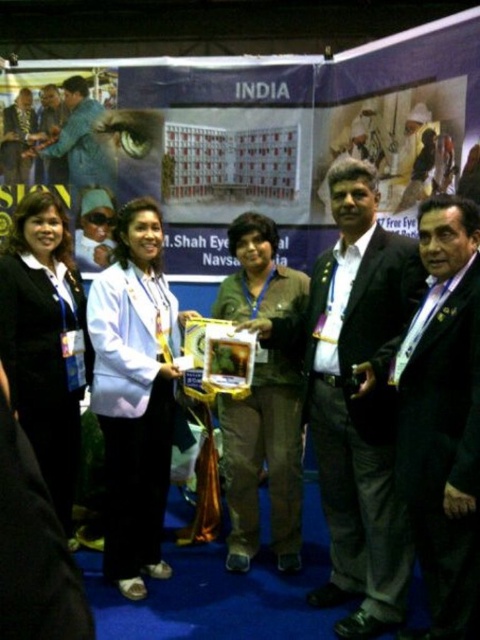
Question: Is the position of matte black sunglasses at upper left more distant than that of matte black suit at center?

Choices:
 (A) yes
 (B) no

Answer: (A)

Question: Estimate the real-world distances between objects in this image. Which object is closer to the brown fabric shirt at center?

Choices:
 (A) black suit at center
 (B) black fabric at center
 (C) white glossy shirt at center
 (D) matte black sunglasses at upper left

Answer: (A)

Question: Is white glossy shirt at center positioned behind matte black sunglasses at upper left?

Choices:
 (A) yes
 (B) no

Answer: (B)

Question: Does white glossy shirt at center have a larger size compared to matte black suit at center?

Choices:
 (A) no
 (B) yes

Answer: (B)

Question: Considering the real-world distances, which object is closest to the black suit at right?

Choices:
 (A) matte black sunglasses at upper left
 (B) matte black suit at center
 (C) white glossy shirt at center
 (D) brown fabric shirt at center

Answer: (D)

Question: Among these points, which one is nearest to the camera?

Choices:
 (A) (332, 472)
 (B) (167, 353)

Answer: (A)